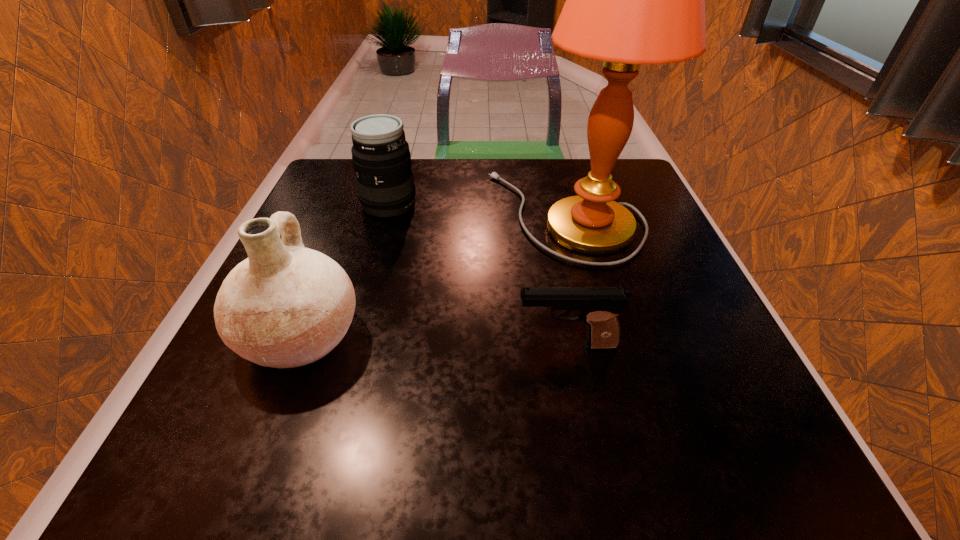
Find the location of a particular element. The height and width of the screenshot is (540, 960). free space between the pistol and the telephoto lens is located at coordinates (478, 274).

At what (x,y) coordinates should I click in order to perform the action: click on vacant region between the shortest object and the telephoto lens. Please return your answer as a coordinate pair (x, y). The width and height of the screenshot is (960, 540). Looking at the image, I should click on (478, 274).

Where is `object that is the second closest to the telephoto lens`? object that is the second closest to the telephoto lens is located at coordinates (285, 306).

Choose which object is the nearest neighbor to the pottery. Please provide its 2D coordinates. Your answer should be formatted as a tuple, i.e. [(x, y)], where the tuple contains the x and y coordinates of a point satisfying the conditions above.

[(630, 0)]

This screenshot has height=540, width=960. Find the location of `free spot that satisfies the following two spatial constraints: 1. on the front side of the tallest object; 2. at the barrel of the shortest object`. free spot that satisfies the following two spatial constraints: 1. on the front side of the tallest object; 2. at the barrel of the shortest object is located at coordinates (598, 345).

Where is `vacant position in the image that satisfies the following two spatial constraints: 1. on the front side of the second shortest object; 2. on the left side of the tallest object`? The height and width of the screenshot is (540, 960). vacant position in the image that satisfies the following two spatial constraints: 1. on the front side of the second shortest object; 2. on the left side of the tallest object is located at coordinates (386, 215).

At what (x,y) coordinates should I click in order to perform the action: click on vacant space that satisfies the following two spatial constraints: 1. on the front side of the telephoto lens; 2. to pour from the handle of the pottery. Please return your answer as a coordinate pair (x, y). The image size is (960, 540). Looking at the image, I should click on pos(351,338).

The height and width of the screenshot is (540, 960). I want to click on free location that satisfies the following two spatial constraints: 1. on the front side of the tallest object; 2. on the right side of the telephoto lens, so click(386, 215).